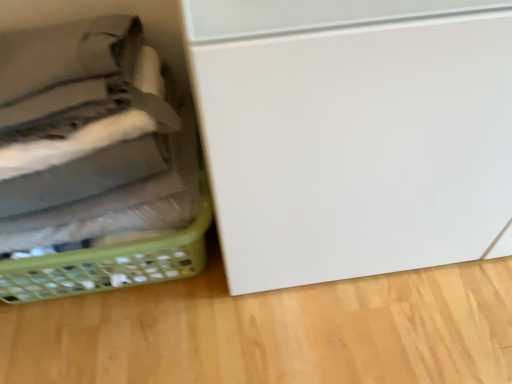
Question: Considering the relative positions of green plastic basket at lower left, the 1th basket from the back, and green plastic basket at left, acting as the 1th basket starting from the front, in the image provided, is green plastic basket at lower left, the 1th basket from the back, to the left or to the right of green plastic basket at left, acting as the 1th basket starting from the front,?

Choices:
 (A) right
 (B) left

Answer: (B)

Question: From the image's perspective, is green plastic basket at lower left, which ranks as the second basket in front-to-back order, located above or below green plastic basket at left, the second basket positioned from the back?

Choices:
 (A) above
 (B) below

Answer: (B)

Question: From a real-world perspective, is green plastic basket at lower left, the 1th basket from the back, positioned above or below green plastic basket at left, the second basket positioned from the back?

Choices:
 (A) above
 (B) below

Answer: (B)

Question: From a real-world perspective, relative to green plastic basket at lower left, which ranks as the second basket in front-to-back order, is green plastic basket at left, the second basket positioned from the back, vertically above or below?

Choices:
 (A) above
 (B) below

Answer: (A)

Question: Would you say green plastic basket at left, acting as the 1th basket starting from the front, is to the left or to the right of green plastic basket at lower left, which ranks as the second basket in front-to-back order, in the picture?

Choices:
 (A) left
 (B) right

Answer: (B)

Question: Is point (167, 102) closer or farther from the camera than point (104, 289)?

Choices:
 (A) closer
 (B) farther

Answer: (A)

Question: Looking at their shapes, would you say green plastic basket at left, the second basket positioned from the back, is wider or thinner than green plastic basket at lower left, the 1th basket from the back?

Choices:
 (A) thin
 (B) wide

Answer: (A)